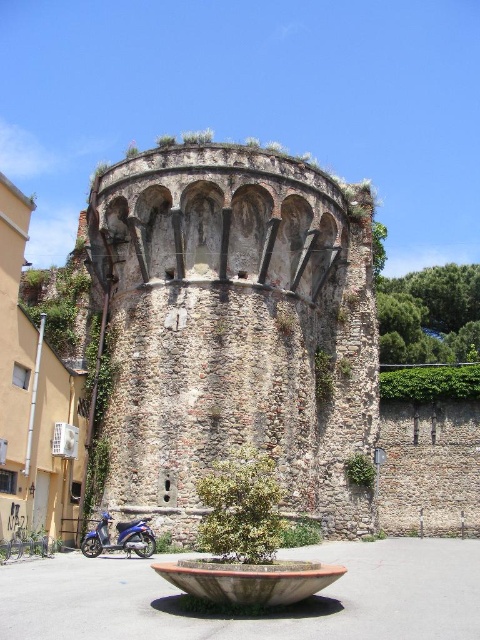
Question: Can you confirm if stone textured tower at center is bigger than blue metallic motorbike at lower left?

Choices:
 (A) no
 (B) yes

Answer: (B)

Question: Which object appears farthest from the camera in this image?

Choices:
 (A) stone textured tower at center
 (B) blue metallic motorbike at lower left

Answer: (A)

Question: Which point appears farthest from the camera in this image?

Choices:
 (A) (152, 508)
 (B) (144, 541)

Answer: (A)

Question: Is stone textured tower at center bigger than blue metallic motorbike at lower left?

Choices:
 (A) no
 (B) yes

Answer: (B)

Question: Can you confirm if stone textured tower at center is positioned below blue metallic motorbike at lower left?

Choices:
 (A) no
 (B) yes

Answer: (A)